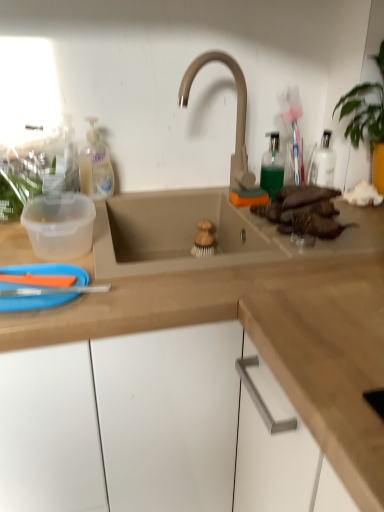
Question: From a real-world perspective, is green translucent bottle at upper right positioned above or below translucent plastic bottle at upper left?

Choices:
 (A) below
 (B) above

Answer: (A)

Question: Is green translucent bottle at upper right taller or shorter than translucent plastic bottle at upper left?

Choices:
 (A) tall
 (B) short

Answer: (B)

Question: Which object is positioned closest to the matte beige faucet at center?

Choices:
 (A) transparent plastic container at left
 (B) green translucent bottle at upper right
 (C) blue plastic paper plate at lower left
 (D) translucent plastic bottle at upper left
 (E) brown matte sweet potato at right

Answer: (B)

Question: Which object is the closest to the brown matte sweet potato at right?

Choices:
 (A) green translucent bottle at upper right
 (B) matte beige faucet at center
 (C) transparent plastic container at left
 (D) translucent plastic bottle at upper left
 (E) blue plastic paper plate at lower left

Answer: (A)